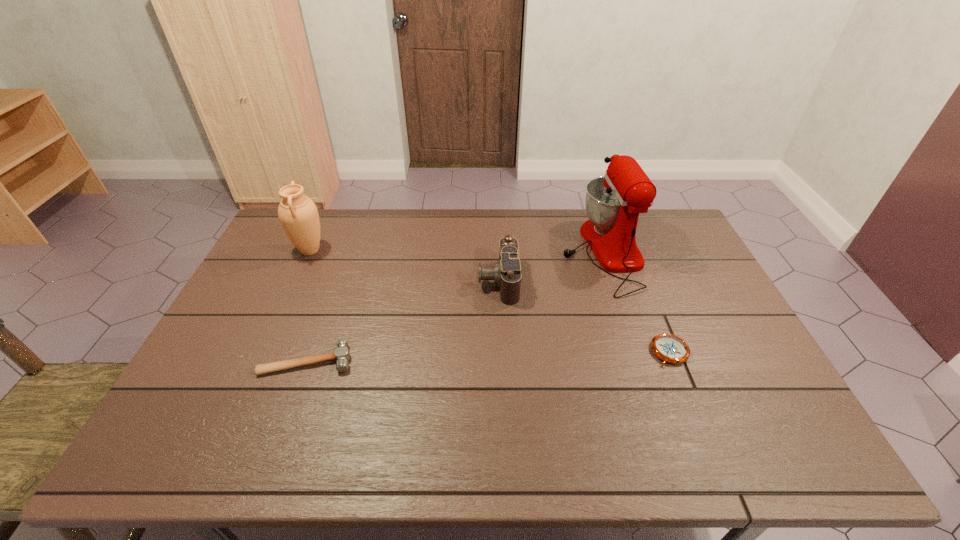
This screenshot has height=540, width=960. I want to click on mixer, so click(x=613, y=202).

Where is `the second tallest object`? Image resolution: width=960 pixels, height=540 pixels. the second tallest object is located at coordinates pos(298,214).

Image resolution: width=960 pixels, height=540 pixels. Find the location of `camera`. camera is located at coordinates (506, 272).

Image resolution: width=960 pixels, height=540 pixels. Find the location of `the third tallest object`. the third tallest object is located at coordinates (506, 272).

Locate an element on the screen. Image resolution: width=960 pixels, height=540 pixels. hammer is located at coordinates (341, 354).

Locate an element on the screen. the shortest object is located at coordinates (670, 348).

Identify the location of free location located 0.230m on the bowl side of the mixer. (495, 252).

The width and height of the screenshot is (960, 540). What are the coordinates of `vacant space located 0.200m on the bowl side of the mixer` in the screenshot? It's located at (504, 252).

At what (x,y) coordinates should I click in order to perform the action: click on free space located 0.340m on the bowl side of the mixer. Please return your answer as a coordinate pair (x, y). Looking at the image, I should click on (463, 252).

Identify the location of vacant space located 0.060m on the back of the fourth shortest object. (320, 229).